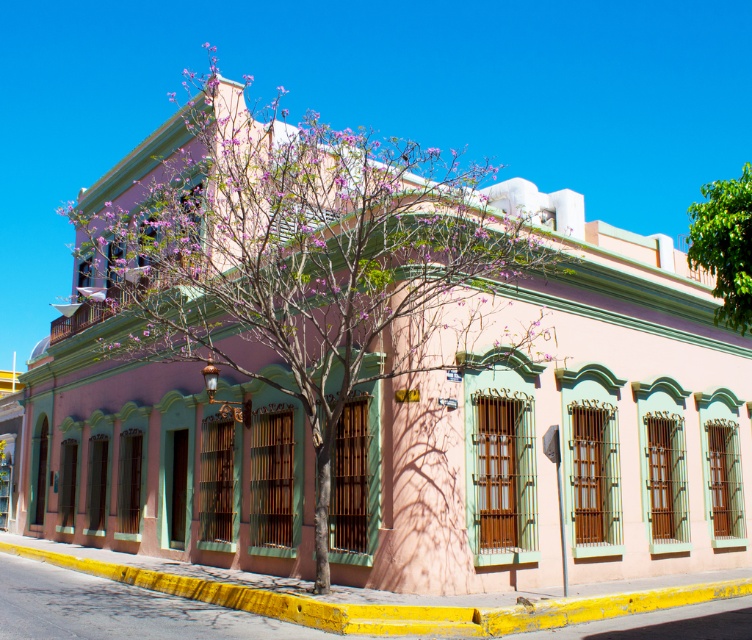
Question: Which point is farther to the camera?

Choices:
 (A) pink textured tree at center
 (B) green leafy tree at upper right

Answer: (A)

Question: Can you confirm if pink textured tree at center is smaller than green leafy tree at upper right?

Choices:
 (A) yes
 (B) no

Answer: (B)

Question: Among these points, which one is farthest from the camera?

Choices:
 (A) (734, 282)
 (B) (411, 387)

Answer: (B)

Question: Is pink textured tree at center wider than green leafy tree at upper right?

Choices:
 (A) no
 (B) yes

Answer: (A)

Question: Does pink textured tree at center have a larger size compared to green leafy tree at upper right?

Choices:
 (A) yes
 (B) no

Answer: (A)

Question: Which of the following is the farthest from the observer?

Choices:
 (A) pink textured tree at center
 (B) green leafy tree at upper right

Answer: (A)